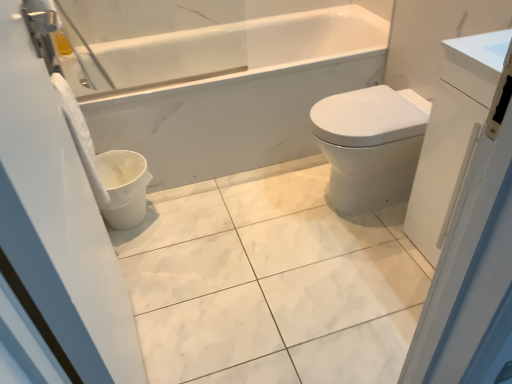
The width and height of the screenshot is (512, 384). I want to click on space that is in front of white glossy toilet bowl at lower left, so click(145, 256).